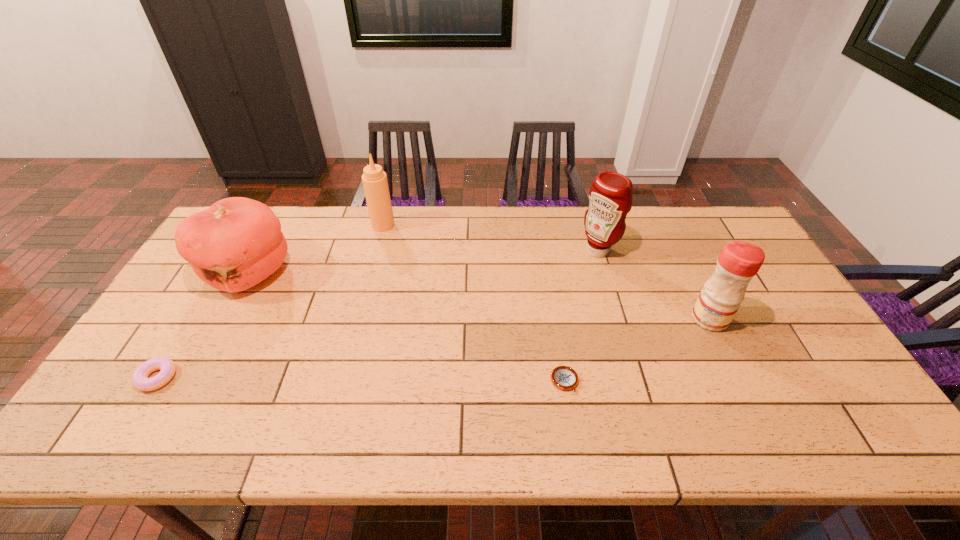
At what (x,y) coordinates should I click in order to perform the action: click on free point between the second object from right to left and the farthest condiment. Please return your answer as a coordinate pair (x, y). The image size is (960, 540). Looking at the image, I should click on (491, 238).

You are a GUI agent. You are given a task and a screenshot of the screen. Output one action in this format:
    pyautogui.click(x=<x>, y=<y>)
    Task: Click on the free point between the shortest object and the doughnut
    
    Given the screenshot: What is the action you would take?
    pyautogui.click(x=361, y=379)

Identify the location of free space between the shortest object and the second condiment from right to left. (581, 315).

I want to click on vacant space in between the rightmost object and the fourth object from right to left, so click(546, 272).

Where is `object identified as the fifth closest to the second condiment from right to left`? The image size is (960, 540). object identified as the fifth closest to the second condiment from right to left is located at coordinates (140, 380).

The height and width of the screenshot is (540, 960). I want to click on object that is the closest one to the pumpkin, so coord(140,380).

This screenshot has width=960, height=540. I want to click on condiment that can be found as the closest to the pumpkin, so click(374, 179).

This screenshot has width=960, height=540. Identify the location of condiment that is the third closest to the pumpkin. (719, 300).

Where is `free spot that satisfies the following two spatial constraints: 1. on the front side of the second condiment from left to right; 2. on the left side of the rightmost condiment`? free spot that satisfies the following two spatial constraints: 1. on the front side of the second condiment from left to right; 2. on the left side of the rightmost condiment is located at coordinates (618, 319).